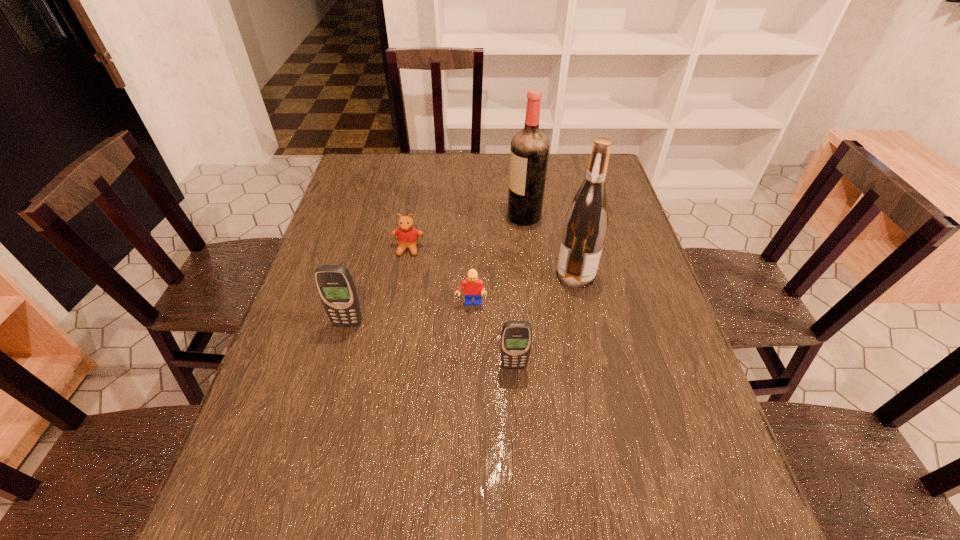
I want to click on the fifth farthest object, so click(x=334, y=283).

You are a GUI agent. You are given a task and a screenshot of the screen. Output one action in this format:
    pyautogui.click(x=<x>, y=<y>)
    Task: Click on the taller cellular telephone
    This screenshot has width=960, height=540.
    Given the screenshot: What is the action you would take?
    pyautogui.click(x=334, y=283)

Where is `the third shortest object`? This screenshot has height=540, width=960. the third shortest object is located at coordinates (516, 336).

What are the coordinates of `the right cellular telephone` in the screenshot? It's located at (516, 336).

I want to click on wine bottle, so click(x=586, y=222).

Locate an element on the screen. This screenshot has height=540, width=960. the fourth nearest object is located at coordinates pos(586,222).

Find the location of a particular element. The height and width of the screenshot is (540, 960). the farthest object is located at coordinates pyautogui.click(x=529, y=153).

Locate an element on the screen. This screenshot has height=540, width=960. the third object from left to right is located at coordinates (473, 287).

At what (x,y) coordinates should I click in order to perform the action: click on Lego. Please return your answer as a coordinate pair (x, y). The height and width of the screenshot is (540, 960). Looking at the image, I should click on (473, 287).

At what (x,y) coordinates should I click in order to perform the action: click on teddy bear. Please return your answer as a coordinate pair (x, y). Image resolution: width=960 pixels, height=540 pixels. Looking at the image, I should click on pos(407,236).